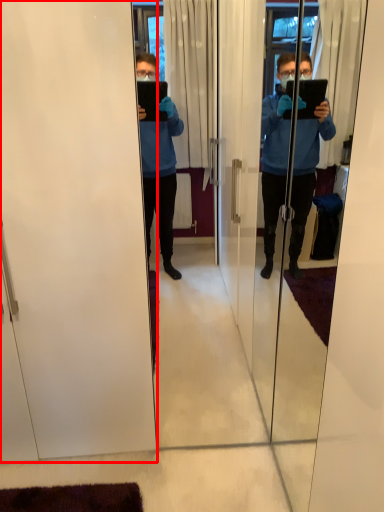
Question: From the image's perspective, where is screen door (annotated by the red box) located in relation to screen door in the image?

Choices:
 (A) above
 (B) below

Answer: (A)